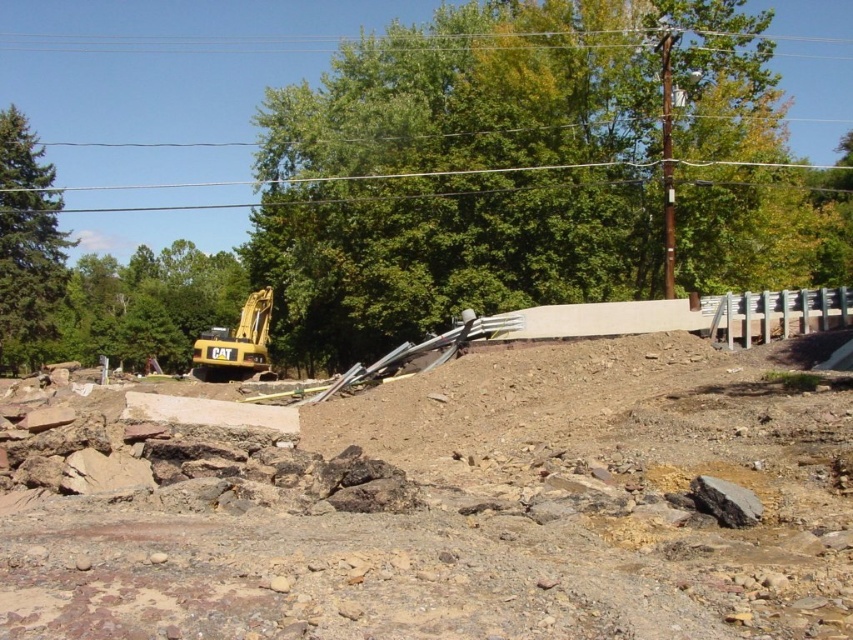
You are a construction worker planning to lift a heavy beam with a crane. The beam is currently lying on the ground near the yellow metallic excavator at left. To avoid hitting the brushed metal power line at upper center, which direction should you move the beam towards?

The brushed metal power line at upper center is above the yellow metallic excavator at left, so to avoid hitting it, you should move the beam away from the direction of the power line, which is towards the upper center. Alternatively, lower the beam to a height below the power line before moving it.